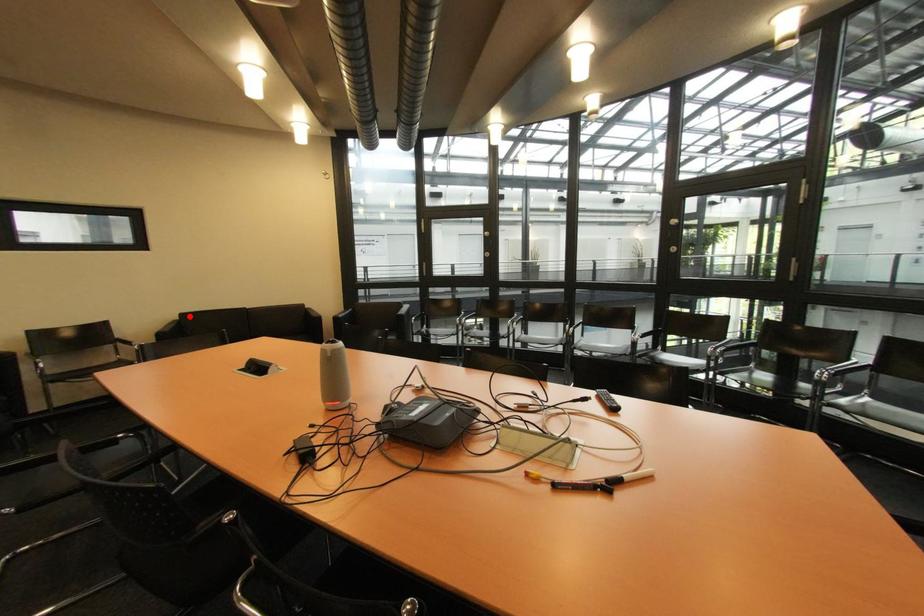
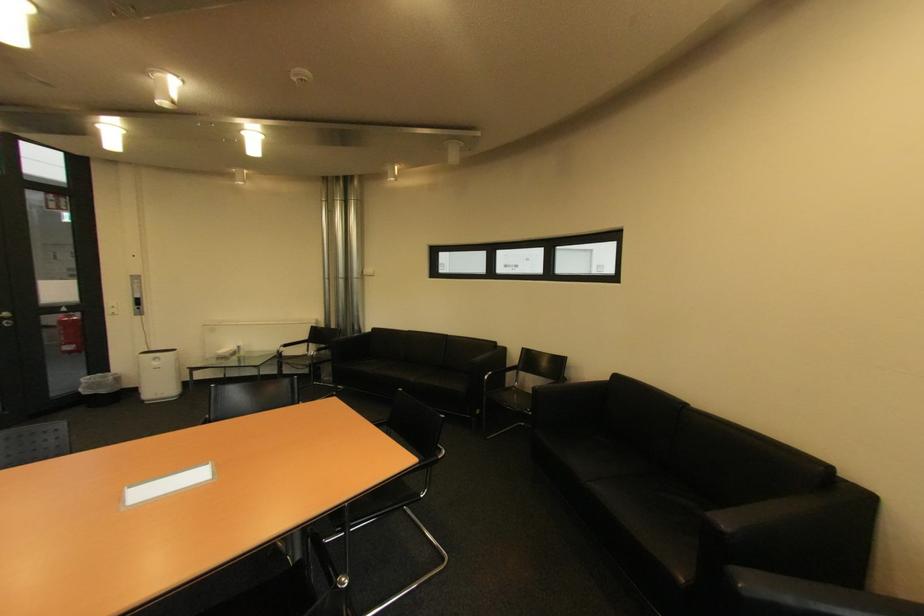
In the second image, find the point that corresponds to the highlighted location in the first image.

(625, 378)